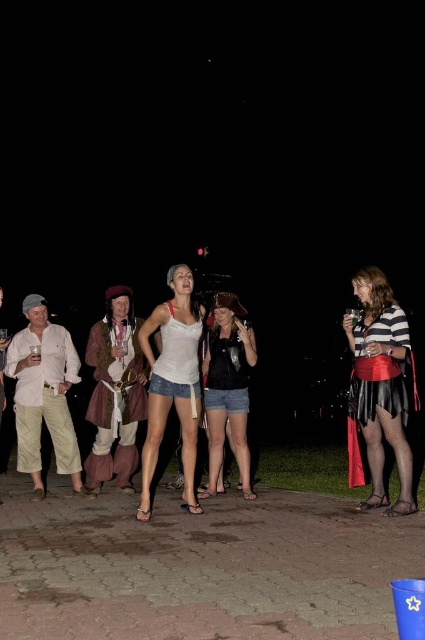
Is light beige cotton pants at left behind white cotton tank top at center?

Yes, light beige cotton pants at left is behind white cotton tank top at center.

Is point (20, 342) positioned behind point (184, 353)?

That is True.

Is point (59, 413) closer to camera compared to point (189, 365)?

No.

Where is `light beige cotton pants at left`? This screenshot has height=640, width=425. light beige cotton pants at left is located at coordinates (44, 394).

Between matte brown leather jacket at center and white cotton tank top at center, which one has more height?

white cotton tank top at center is taller.

Is matte brown leather jacket at center above white cotton tank top at center?

Incorrect, matte brown leather jacket at center is not positioned above white cotton tank top at center.

Is point (121, 364) positioned behind point (183, 404)?

Yes.

Locate an element on the screen. The width and height of the screenshot is (425, 640). matte brown leather jacket at center is located at coordinates (116, 392).

How much distance is there between light beige cotton pants at left and matte black shirt at center?

6.13 feet

In the scene shown: Who is more forward, (73, 374) or (212, 444)?

Point (73, 374) is in front.

Image resolution: width=425 pixels, height=640 pixels. I want to click on light beige cotton pants at left, so click(x=44, y=394).